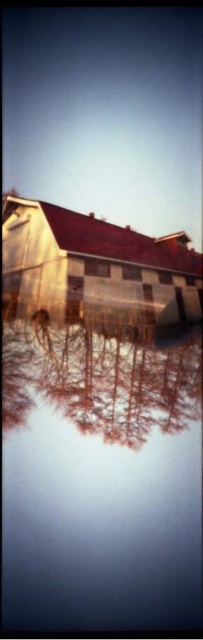
Question: Does transparent glass water at center have a lesser width compared to wooden barn at center?

Choices:
 (A) no
 (B) yes

Answer: (B)

Question: Which of the following is the farthest from the observer?

Choices:
 (A) wooden barn at center
 (B) transparent glass water at center
 (C) smooth glass trees at center

Answer: (A)

Question: Can you confirm if transparent glass water at center is wider than wooden barn at center?

Choices:
 (A) yes
 (B) no

Answer: (B)

Question: Which point is closer to the camera taking this photo?

Choices:
 (A) (42, 333)
 (B) (99, 268)

Answer: (A)

Question: Is wooden barn at center closer to camera compared to smooth glass trees at center?

Choices:
 (A) no
 (B) yes

Answer: (A)

Question: Among these points, which one is farthest from the camera?

Choices:
 (A) (63, 390)
 (B) (137, 584)

Answer: (A)